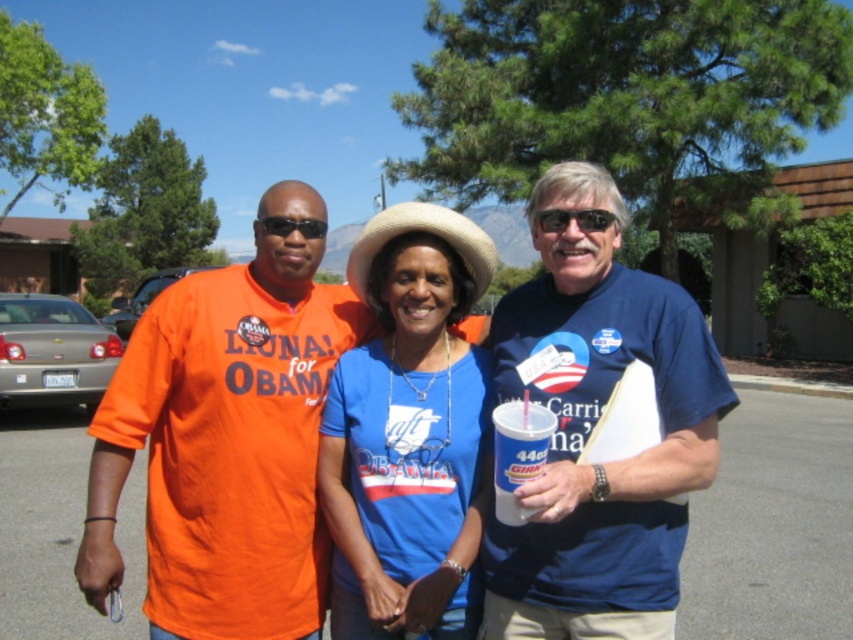
Between orange cotton shirt at left and gray asphalt parking lot at center, which one is positioned higher?

orange cotton shirt at left is higher up.

Who is more forward, (712, 468) or (733, 611)?

Point (712, 468)

Locate an element on the screen. Image resolution: width=853 pixels, height=640 pixels. orange cotton shirt at left is located at coordinates (598, 413).

Identify the location of orange cotton shirt at left. The width and height of the screenshot is (853, 640). (598, 413).

Does blue cotton shirt at center appear on the right side of blue fabric shirt at center?

Yes, blue cotton shirt at center is to the right of blue fabric shirt at center.

The image size is (853, 640). Find the location of `blue cotton shirt at center`. blue cotton shirt at center is located at coordinates (595, 422).

How far apart are matte orange t-shirt at center and blue fabric shirt at center?

matte orange t-shirt at center and blue fabric shirt at center are 11.78 inches apart from each other.

Can you confirm if matte orange t-shirt at center is shorter than blue fabric shirt at center?

In fact, matte orange t-shirt at center may be taller than blue fabric shirt at center.

This screenshot has width=853, height=640. What do you see at coordinates (227, 436) in the screenshot? I see `matte orange t-shirt at center` at bounding box center [227, 436].

What are the coordinates of `matte orange t-shirt at center` in the screenshot? It's located at (227, 436).